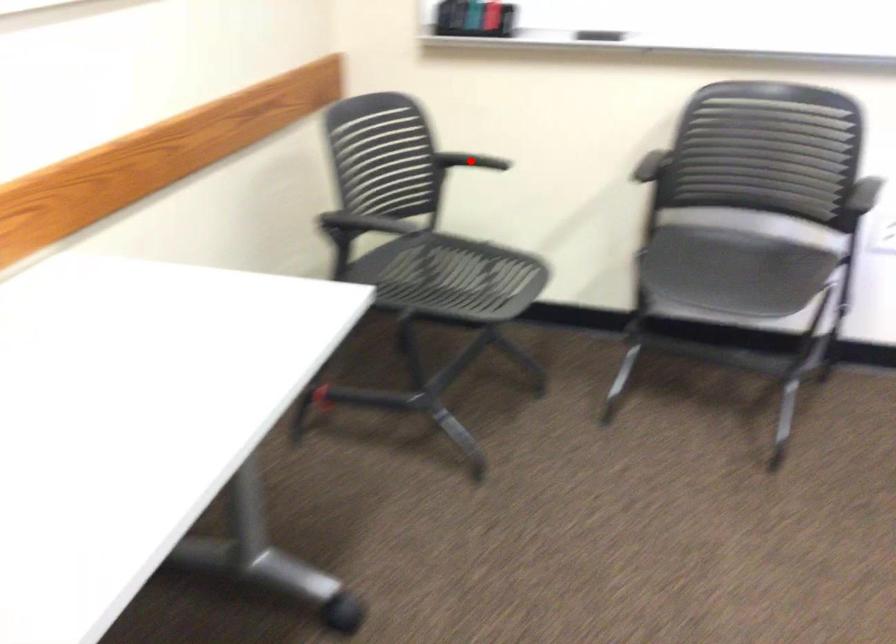
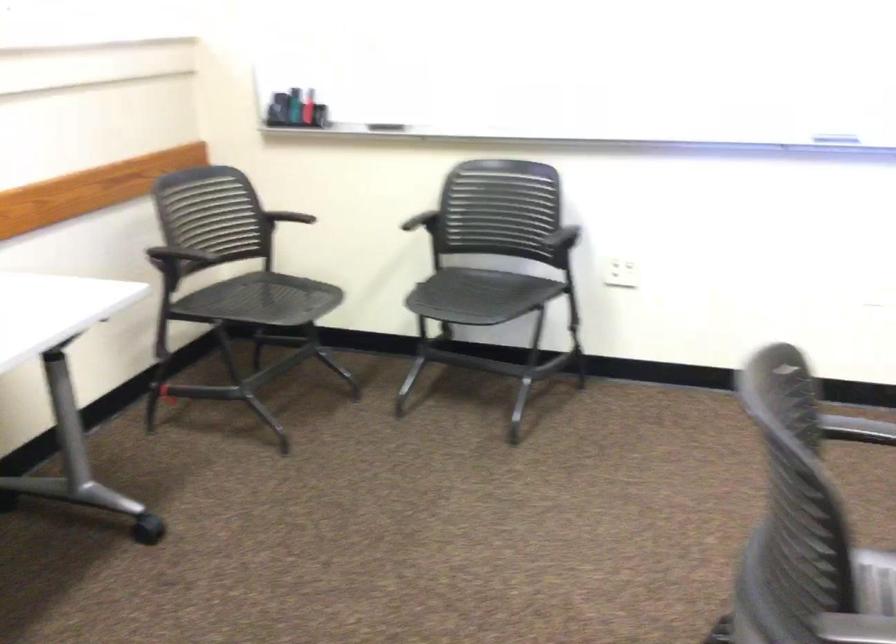
Question: I am providing you with two images of the same scene from different viewpoints. A red point is shown in image1. For the corresponding object point in image2, is it positioned nearer or farther from the camera?

Choices:
 (A) Nearer
 (B) Farther

Answer: (B)